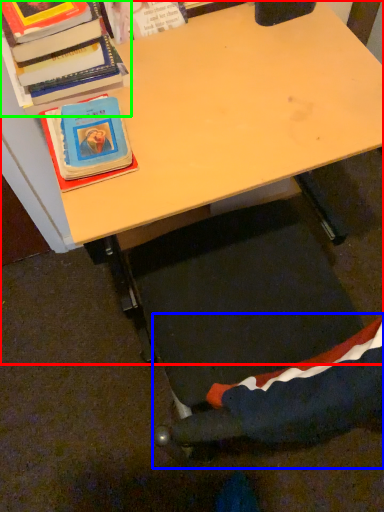
Question: Which is nearer to the desk (highlighted by a red box)? swivel chair (highlighted by a blue box) or book (highlighted by a green box).

Choices:
 (A) swivel chair
 (B) book

Answer: (B)